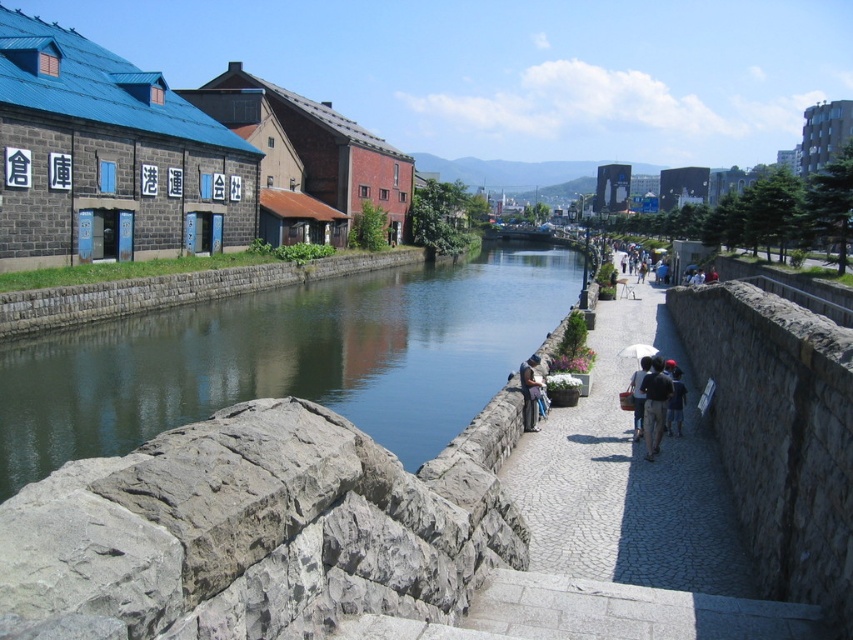
Looking at this image, who is more distant from viewer, (595, 380) or (526, 397)?

Point (595, 380)

Does cobblestone pathway at center appear on the right side of matte blue shirt at center?

Correct, you'll find cobblestone pathway at center to the right of matte blue shirt at center.

Which is behind, point (614, 467) or point (538, 403)?

The point (538, 403) is more distant.

Where is `cobblestone pathway at center`? cobblestone pathway at center is located at coordinates (627, 480).

Is cobblestone pathway at center positioned at the back of black fabric backpack at lower center?

No.

Consider the image. Is cobblestone pathway at center smaller than black fabric backpack at lower center?

Actually, cobblestone pathway at center might be larger than black fabric backpack at lower center.

Where is `cobblestone pathway at center`? cobblestone pathway at center is located at coordinates (627, 480).

Looking at this image, is smooth concrete river at center closer to camera compared to matte black umbrella at center?

That is False.

Which is behind, point (79, 337) or point (643, 372)?

Point (79, 337)

Is point (479, 404) positioned in front of point (647, 365)?

No, (479, 404) is behind (647, 365).

Where is `smooth concrete river at center`? The image size is (853, 640). smooth concrete river at center is located at coordinates coord(289,358).